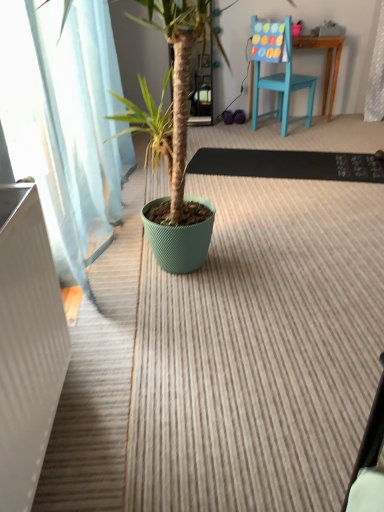
Question: Would you consider black rubber doormat at center, the 2th doormat positioned from the bottom, to be distant from rug at center, the 2th doormat positioned from the top?

Choices:
 (A) no
 (B) yes

Answer: (B)

Question: Could you tell me if black rubber doormat at center, the 2th doormat positioned from the bottom, is turned towards rug at center, the first doormat in the bottom-to-top sequence?

Choices:
 (A) yes
 (B) no

Answer: (A)

Question: Is black rubber doormat at center, the 2th doormat positioned from the bottom, thinner than rug at center, the first doormat in the bottom-to-top sequence?

Choices:
 (A) yes
 (B) no

Answer: (A)

Question: Considering the relative positions of black rubber doormat at center, positioned as the first doormat in top-to-bottom order, and rug at center, the 2th doormat positioned from the top, in the image provided, is black rubber doormat at center, positioned as the first doormat in top-to-bottom order, in front of rug at center, the 2th doormat positioned from the top,?

Choices:
 (A) yes
 (B) no

Answer: (B)

Question: From the image's perspective, is black rubber doormat at center, the 2th doormat positioned from the bottom, located above rug at center, the first doormat in the bottom-to-top sequence?

Choices:
 (A) no
 (B) yes

Answer: (B)

Question: Is black rubber doormat at center, positioned as the first doormat in top-to-bottom order, not inside rug at center, the first doormat in the bottom-to-top sequence?

Choices:
 (A) yes
 (B) no

Answer: (B)

Question: Is there a large distance between teal wooden chair at upper right and black rubber doormat at center, positioned as the first doormat in top-to-bottom order?

Choices:
 (A) no
 (B) yes

Answer: (A)

Question: Is teal wooden chair at upper right to the right of black rubber doormat at center, the 2th doormat positioned from the bottom, from the viewer's perspective?

Choices:
 (A) no
 (B) yes

Answer: (B)

Question: Is black rubber doormat at center, the 2th doormat positioned from the bottom, located within teal wooden chair at upper right?

Choices:
 (A) yes
 (B) no

Answer: (B)

Question: From a real-world perspective, is teal wooden chair at upper right physically below black rubber doormat at center, the 2th doormat positioned from the bottom?

Choices:
 (A) no
 (B) yes

Answer: (A)

Question: Does teal wooden chair at upper right have a lesser width compared to black rubber doormat at center, positioned as the first doormat in top-to-bottom order?

Choices:
 (A) yes
 (B) no

Answer: (A)

Question: Considering the relative sizes of teal wooden chair at upper right and black rubber doormat at center, the 2th doormat positioned from the bottom, in the image provided, is teal wooden chair at upper right bigger than black rubber doormat at center, the 2th doormat positioned from the bottom,?

Choices:
 (A) yes
 (B) no

Answer: (A)

Question: From a real-world perspective, is rug at center, the 2th doormat positioned from the top, physically below black rubber doormat at center, positioned as the first doormat in top-to-bottom order?

Choices:
 (A) yes
 (B) no

Answer: (A)